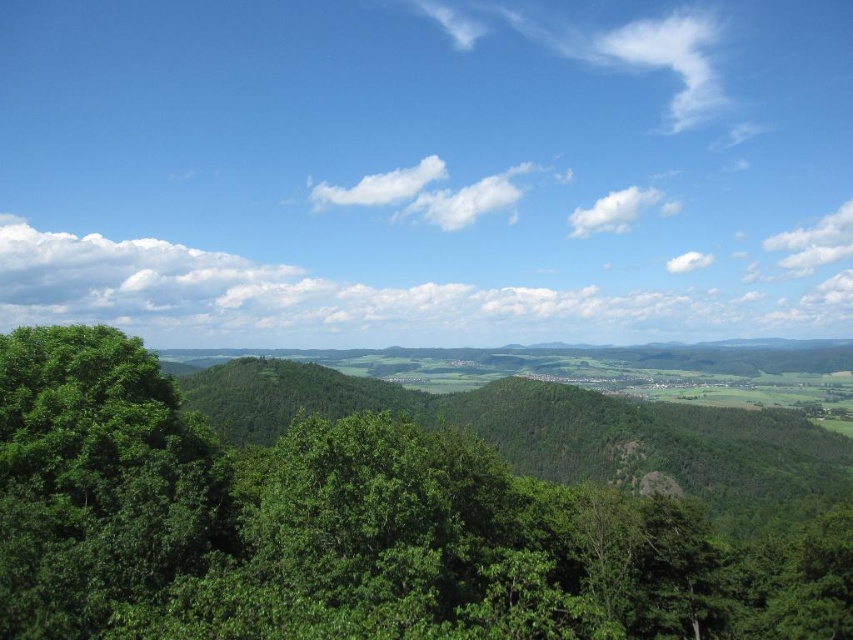
You are standing in the lush green landscape and want to walk from your current position to a point that is behind both point (440, 576) and point (126, 369). Which point should you pass through first?

You should pass through point (440, 576) first because it is in front of point (126, 369), so to reach the point behind both, you must go through point (440, 576) before reaching point (126, 369).